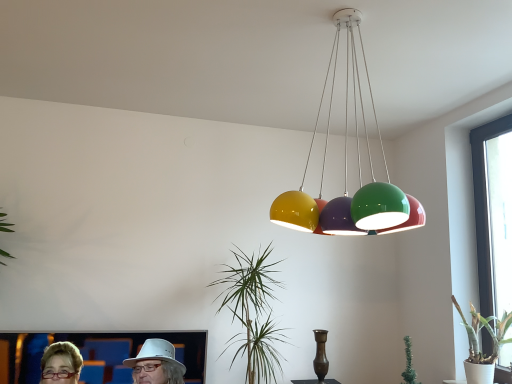
Question: From a real-world perspective, does transparent glass window at right stand above matte white hat at lower left?

Choices:
 (A) yes
 (B) no

Answer: (A)

Question: Is transparent glass window at right facing towards matte white hat at lower left?

Choices:
 (A) yes
 (B) no

Answer: (A)

Question: Considering the relative sizes of transparent glass window at right and matte white hat at lower left in the image provided, is transparent glass window at right smaller than matte white hat at lower left?

Choices:
 (A) no
 (B) yes

Answer: (B)

Question: From a real-world perspective, is transparent glass window at right beneath matte white hat at lower left?

Choices:
 (A) yes
 (B) no

Answer: (B)

Question: Does transparent glass window at right lie behind matte white hat at lower left?

Choices:
 (A) no
 (B) yes

Answer: (B)

Question: Is matte white hat at lower left bigger or smaller than glossy multicolored globe lights at upper center?

Choices:
 (A) small
 (B) big

Answer: (A)

Question: In the image, is matte white hat at lower left positioned in front of or behind glossy multicolored globe lights at upper center?

Choices:
 (A) front
 (B) behind

Answer: (B)

Question: Is point (151, 359) closer or farther from the camera than point (402, 230)?

Choices:
 (A) closer
 (B) farther

Answer: (B)

Question: From the image's perspective, is matte white hat at lower left located above or below glossy multicolored globe lights at upper center?

Choices:
 (A) below
 (B) above

Answer: (A)

Question: Is matte white hat at lower left inside or outside of green glossy plant at center, acting as the first houseplant starting from the left?

Choices:
 (A) outside
 (B) inside

Answer: (A)

Question: Considering their positions, is matte white hat at lower left located in front of or behind green glossy plant at center, acting as the first houseplant starting from the left?

Choices:
 (A) front
 (B) behind

Answer: (A)

Question: Is matte white hat at lower left taller or shorter than green glossy plant at center, which ranks as the 2th houseplant in right-to-left order?

Choices:
 (A) tall
 (B) short

Answer: (B)

Question: From the image's perspective, relative to green glossy plant at center, acting as the first houseplant starting from the left, is matte white hat at lower left above or below?

Choices:
 (A) above
 (B) below

Answer: (B)

Question: Does point (505, 324) appear closer or farther from the camera than point (336, 29)?

Choices:
 (A) farther
 (B) closer

Answer: (A)

Question: Do you think white ceramic pot at lower right, arranged as the first houseplant when viewed from the right, is within glossy multicolored globe lights at upper center, or outside of it?

Choices:
 (A) outside
 (B) inside

Answer: (A)